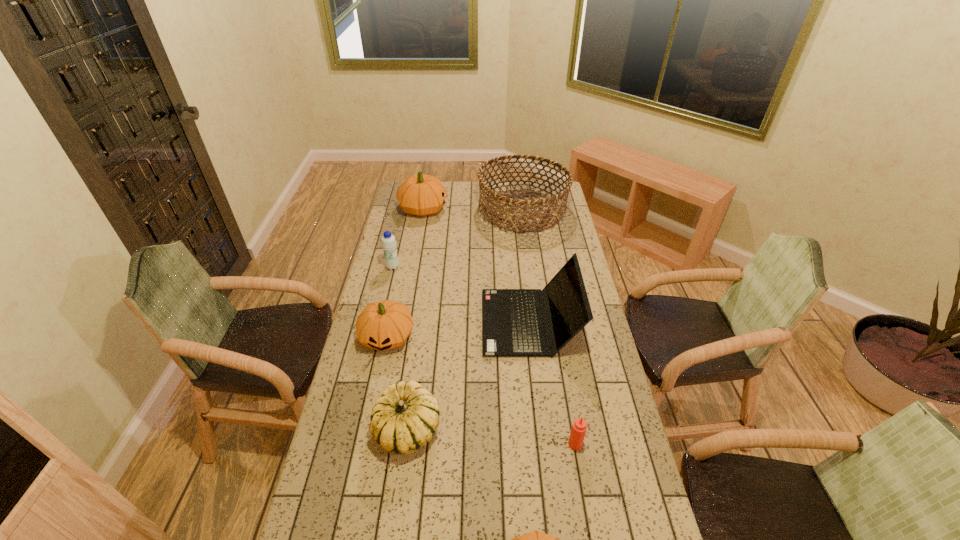
Identify the location of free space located 0.050m on the side of the farthest gourd with the carved face. (458, 209).

Find the location of a particular element. vacant space located 0.360m on the front of the basket is located at coordinates (533, 287).

Image resolution: width=960 pixels, height=540 pixels. I want to click on vacant point located on the screen of the laptop computer, so click(396, 322).

This screenshot has height=540, width=960. Find the location of `free space located on the screen of the laptop computer`. free space located on the screen of the laptop computer is located at coordinates (429, 322).

Where is `vacant region located on the screen of the laptop computer`? vacant region located on the screen of the laptop computer is located at coordinates (414, 322).

You are a GUI agent. You are given a task and a screenshot of the screen. Output one action in this format:
    pyautogui.click(x=<x>, y=<y>)
    Task: Click on the free space located on the front of the water bottle
    The image size is (960, 540).
    Given the screenshot: What is the action you would take?
    pyautogui.click(x=379, y=327)

The height and width of the screenshot is (540, 960). In order to click on vacant space situated on the side of the second smallest orange gourd with the carved face in this screenshot , I will do `click(374, 397)`.

Locate an element on the screen. The width and height of the screenshot is (960, 540). vacant space located on the back of the white gourd is located at coordinates (422, 319).

Find the location of a particular element. The width and height of the screenshot is (960, 540). vacant space located 0.180m on the front of the Tabasco sauce is located at coordinates (588, 514).

The height and width of the screenshot is (540, 960). Identify the location of gourd that is at the far edge. (421, 195).